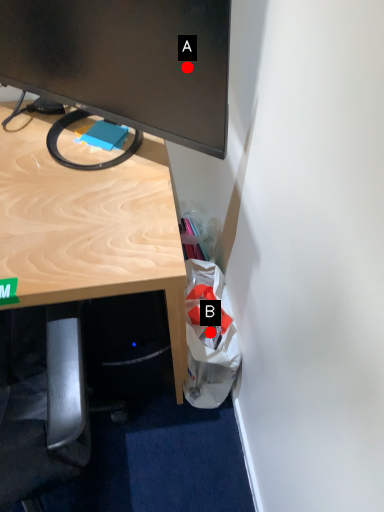
Question: Two points are circled on the image, labeled by A and B beside each circle. Which point is farther from the camera taking this photo?

Choices:
 (A) A is further
 (B) B is further

Answer: (B)